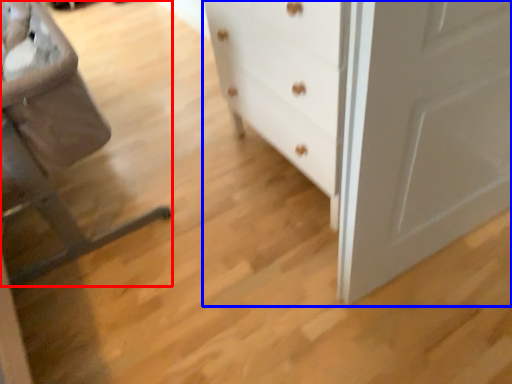
Question: Which of the following is the closest to the observer, rocking chair (highlighted by a red box) or chest of drawers (highlighted by a blue box)?

Choices:
 (A) rocking chair
 (B) chest of drawers

Answer: (A)